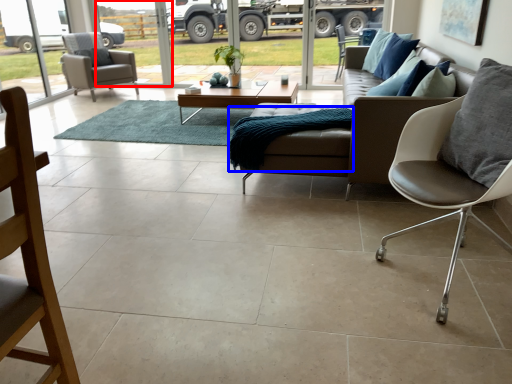
Question: Which object appears closest to the camera in this image, window screen (highlighted by a red box) or blanket (highlighted by a blue box)?

Choices:
 (A) window screen
 (B) blanket

Answer: (B)